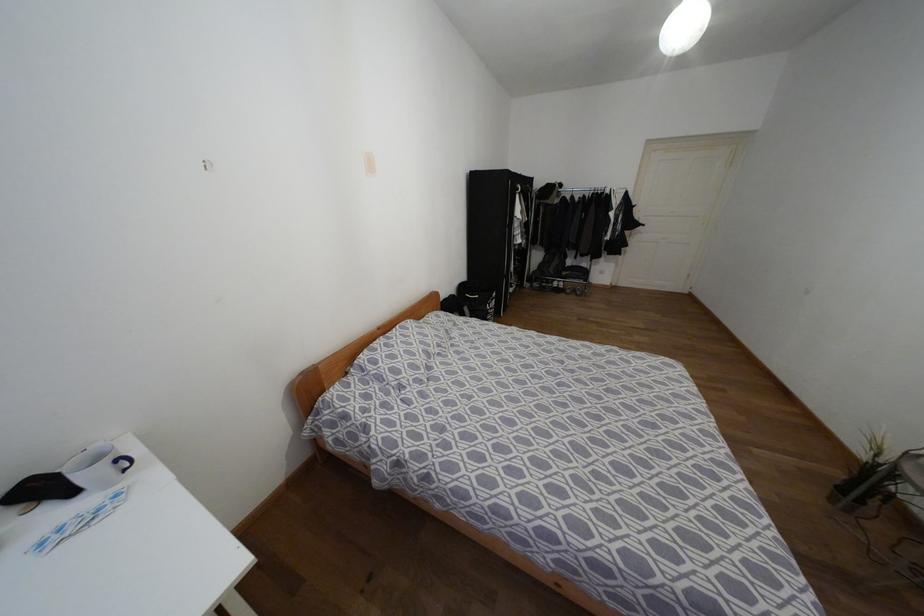
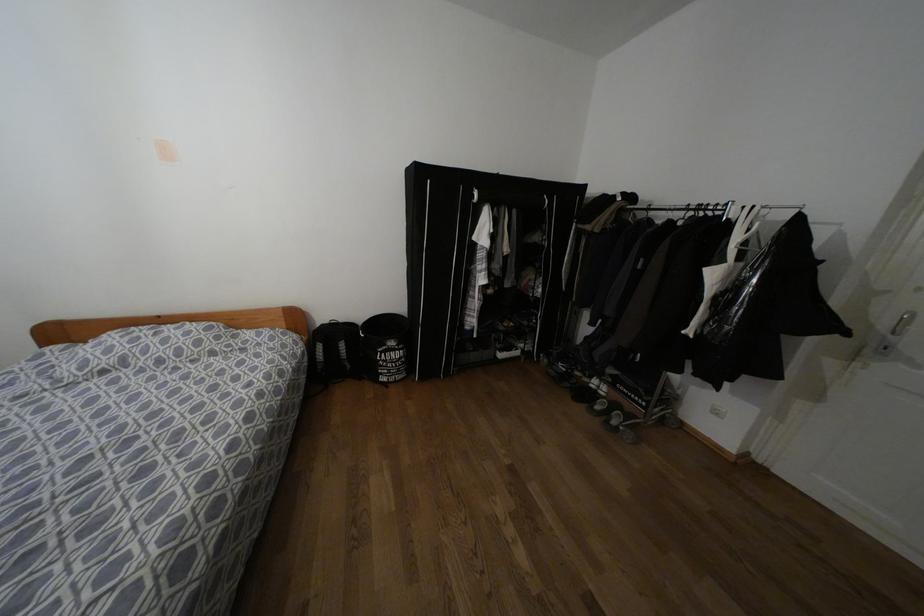
In the second image, find the point that corresponds to the point at 493,294 in the first image.

(391, 342)